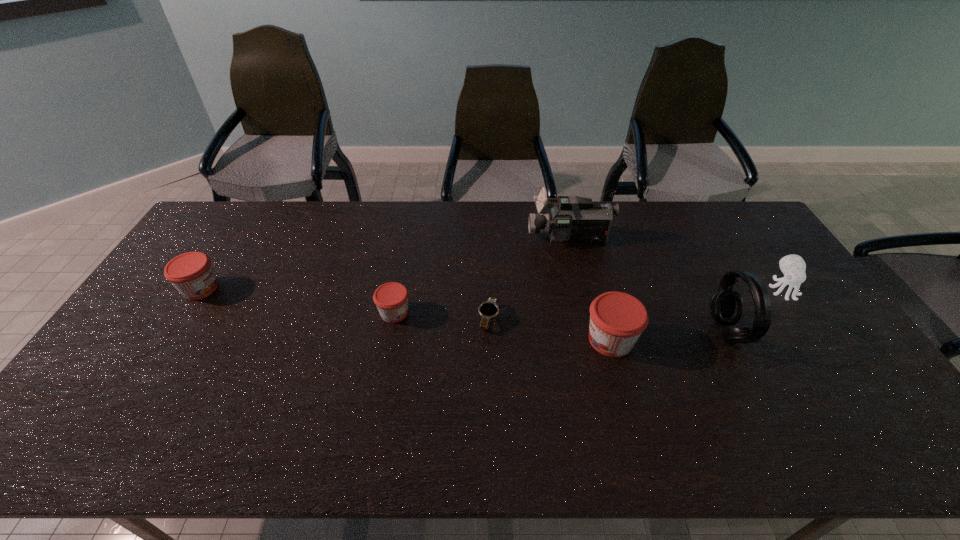
In the image, there is a desktop. At what (x,y) coordinates should I click in order to perform the action: click on vacant area at the near left corner. Please return your answer as a coordinate pair (x, y). Image resolution: width=960 pixels, height=540 pixels. Looking at the image, I should click on (88, 411).

Find the location of a particular element. free space between the rightmost object and the headset is located at coordinates (755, 310).

Identify the location of free space between the farthest object and the octopus. (676, 264).

Where is `unoccupied area between the rightmost object and the headset`? unoccupied area between the rightmost object and the headset is located at coordinates (755, 310).

Locate an element on the screen. This screenshot has height=540, width=960. free spot between the watch and the leftmost object is located at coordinates (345, 303).

You are a GUI agent. You are given a task and a screenshot of the screen. Output one action in this format:
    pyautogui.click(x=<x>, y=<y>)
    Task: Click on the vacant region between the second object from right to left and the rightmost jam
    Image resolution: width=960 pixels, height=540 pixels.
    Given the screenshot: What is the action you would take?
    pyautogui.click(x=669, y=336)

You are a GUI agent. You are given a task and a screenshot of the screen. Output one action in this format:
    pyautogui.click(x=<x>, y=<y>)
    Task: Click on the object that is the fifth closest to the rightmost jam
    The height and width of the screenshot is (540, 960).
    Given the screenshot: What is the action you would take?
    pyautogui.click(x=391, y=299)

Select which object is the closest to the leftmost jam. Please provide its 2D coordinates. Your answer should be formatted as a tuple, i.e. [(x, y)], where the tuple contains the x and y coordinates of a point satisfying the conditions above.

[(391, 299)]

Locate an element on the screen. jam that is the second closest to the sixth object from left to right is located at coordinates (391, 299).

The height and width of the screenshot is (540, 960). Find the location of `jam that is the second closest to the octopus`. jam that is the second closest to the octopus is located at coordinates (391, 299).